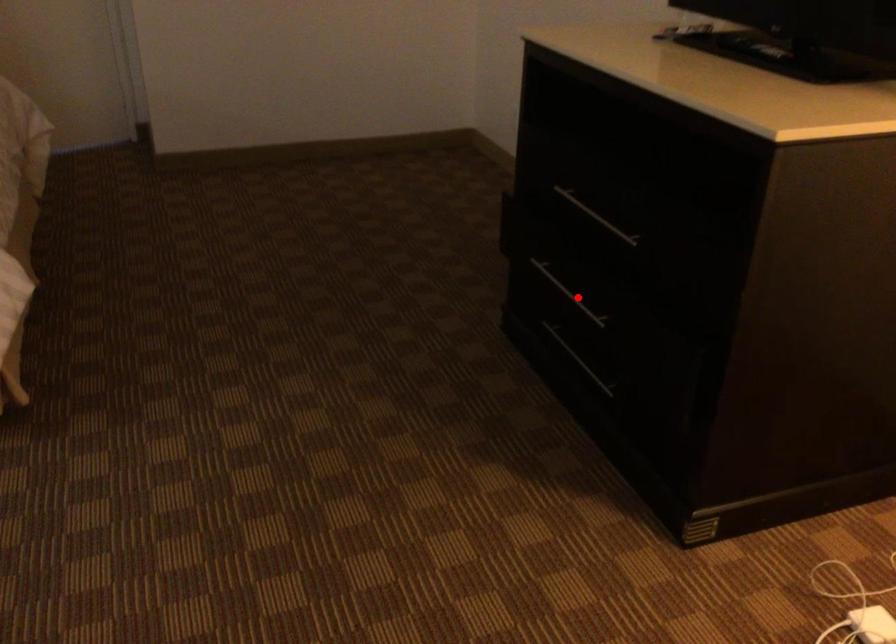
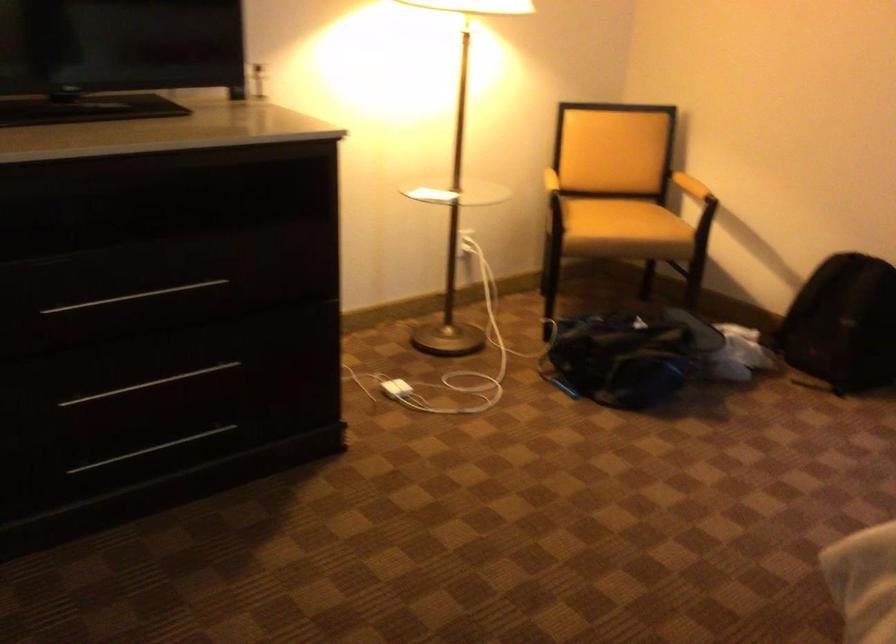
Where in the second image is the point corresponding to the highlighted location from the first image?

(149, 384)